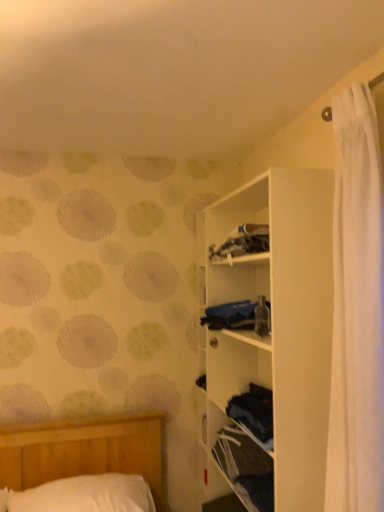
Question: In terms of width, does white matte shelf at upper right look wider or thinner when compared to white soft pillow at lower left?

Choices:
 (A) thin
 (B) wide

Answer: (A)

Question: Looking at the image, does white matte shelf at upper right seem bigger or smaller compared to white soft pillow at lower left?

Choices:
 (A) small
 (B) big

Answer: (B)

Question: Considering the real-world distances, which object is farthest from the white soft pillow at lower left?

Choices:
 (A) white matte shelf at upper right
 (B) blue fabric at center

Answer: (B)

Question: Which of these objects is positioned farthest from the white matte shelf at upper right?

Choices:
 (A) white soft pillow at lower left
 (B) blue fabric at center

Answer: (A)